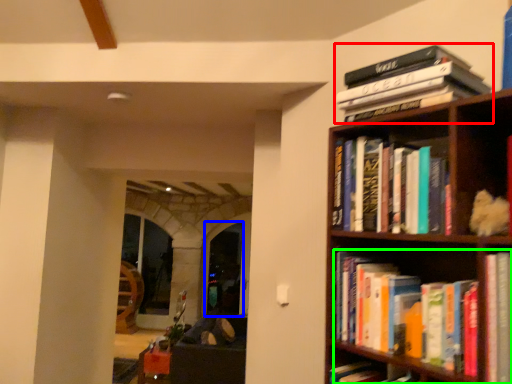
Question: Which object is positioned farthest from book (highlighted by a red box)? Select from glass door (highlighted by a blue box) and book (highlighted by a green box).

Choices:
 (A) glass door
 (B) book

Answer: (A)